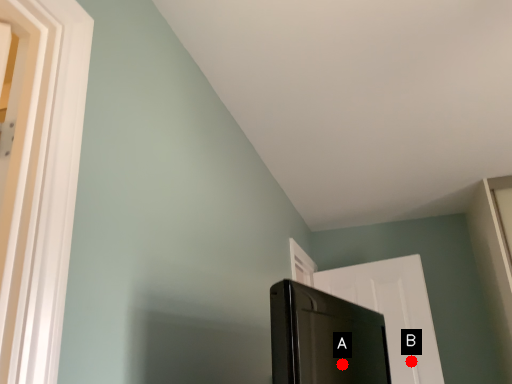
Question: Two points are circled on the image, labeled by A and B beside each circle. Which point is closer to the camera taking this photo?

Choices:
 (A) A is closer
 (B) B is closer

Answer: (A)